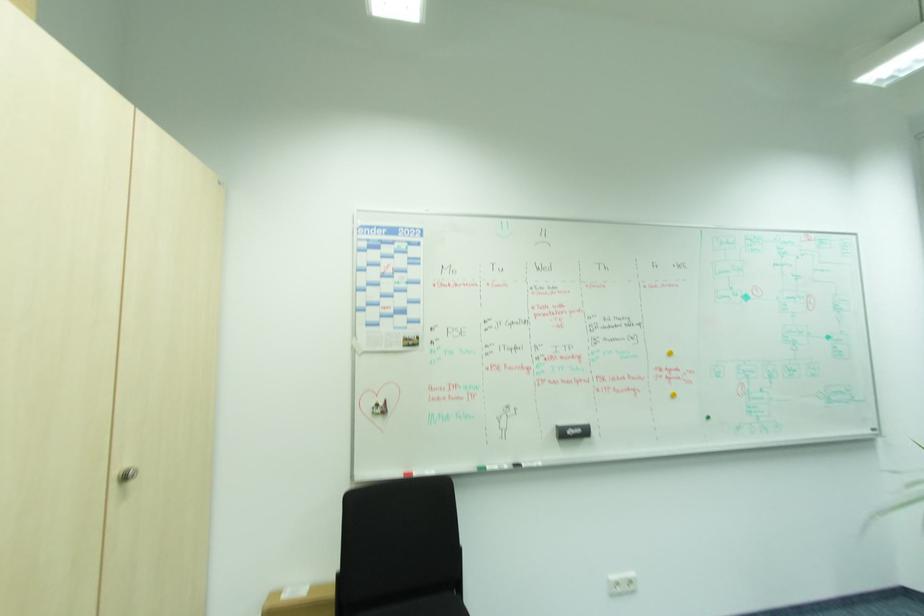
At what (x,y) coordinates should I click in order to perform the action: click on blue whiteboard marker. Please return your answer as a coordinate pair (x, y). The height and width of the screenshot is (616, 924). Looking at the image, I should click on (527, 464).